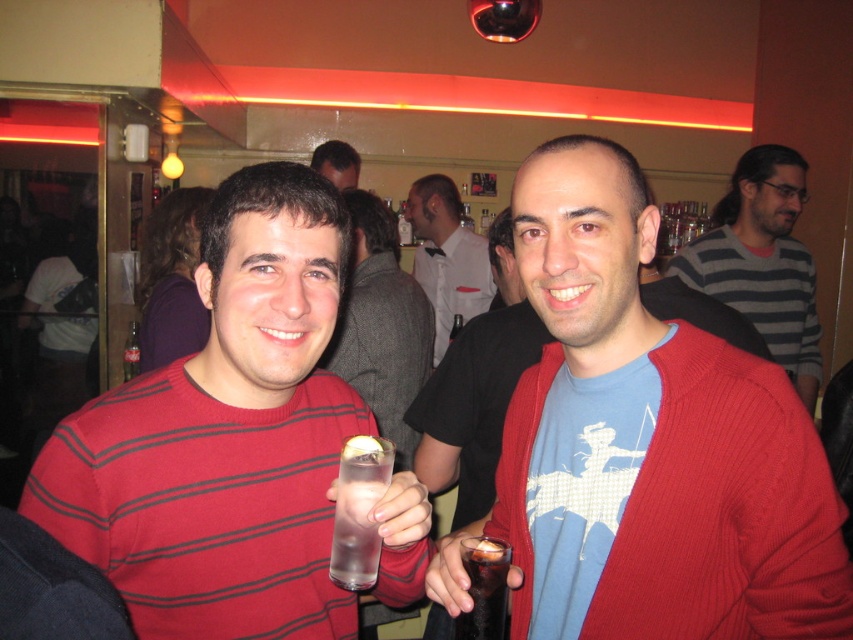
Between matte black sweater at center and clear glass water at center, which one has less height?

clear glass water at center is shorter.

Does point (364, 216) come closer to viewer compared to point (334, 552)?

No, (364, 216) is behind (334, 552).

Find the location of `matte black sweater at center`. matte black sweater at center is located at coordinates (381, 324).

Locate an element on the screen. The width and height of the screenshot is (853, 640). matte black sweater at center is located at coordinates (381, 324).

Is matte black shirt at center shorter than clear glass bottle at center?

No.

Is point (496, 284) behind point (126, 376)?

No, it is not.

The width and height of the screenshot is (853, 640). I want to click on matte black shirt at center, so click(503, 262).

Is striped sweater at center to the right of clear glass water at center from the viewer's perspective?

Incorrect, striped sweater at center is not on the right side of clear glass water at center.

Does striped sweater at center have a smaller size compared to clear glass water at center?

Actually, striped sweater at center might be larger than clear glass water at center.

Where is `striped sweater at center`? striped sweater at center is located at coordinates (224, 436).

The width and height of the screenshot is (853, 640). In order to click on striped sweater at center in this screenshot , I will do `click(224, 436)`.